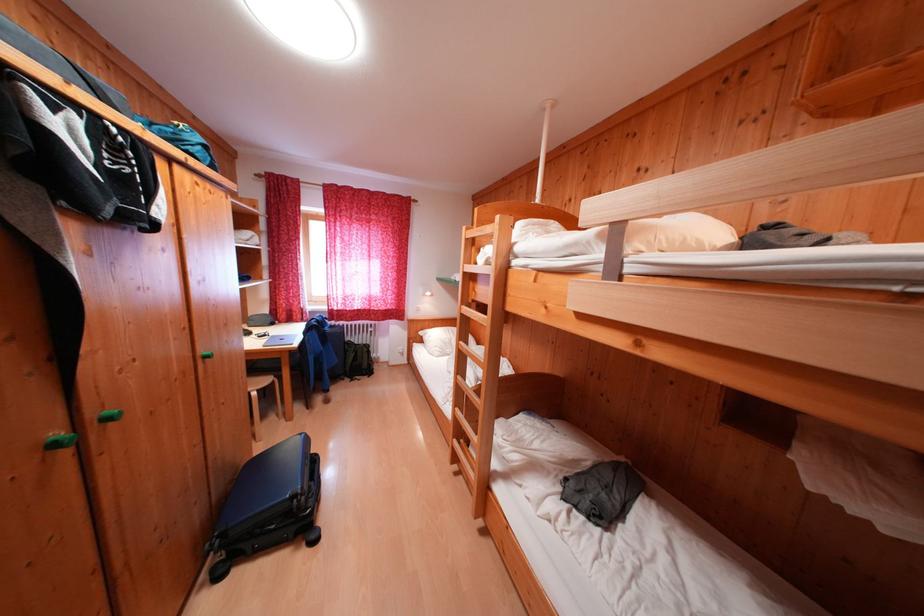
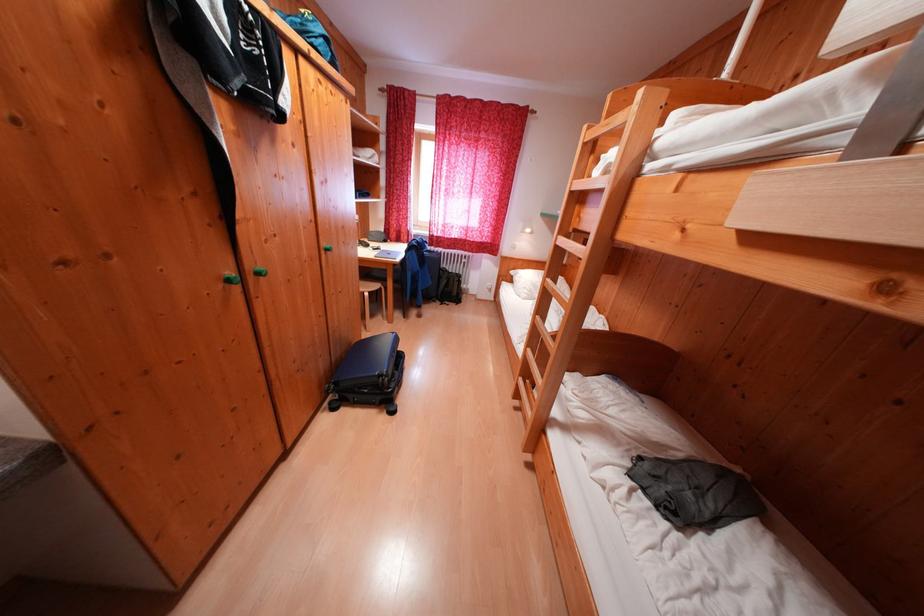
Question: I am providing you with two images of the same scene from different viewpoints. Which of the following objects are not visible in image2?

Choices:
 (A) wooden bunk bed ladder
 (B) white pillow
 (C) blue suitcase
 (D) none of these

Answer: (D)